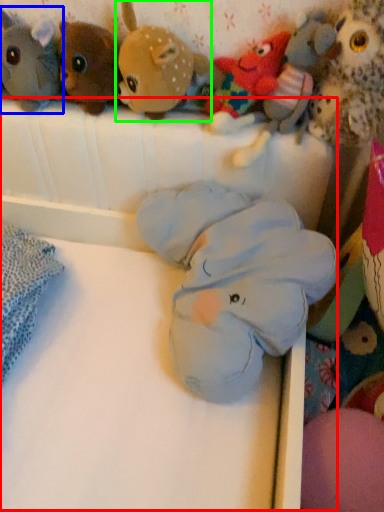
Question: Which is farther away from infant bed (highlighted by a red box)? toy (highlighted by a blue box) or toy (highlighted by a green box)?

Choices:
 (A) toy
 (B) toy

Answer: (A)